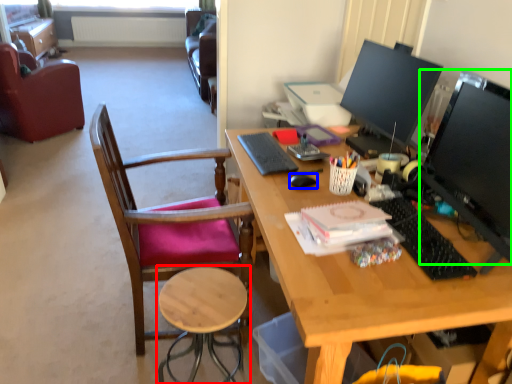
Question: Which object is positioned farthest from stool (highlighted by a red box)? Select from mouse (highlighted by a blue box) and television (highlighted by a green box).

Choices:
 (A) mouse
 (B) television

Answer: (B)